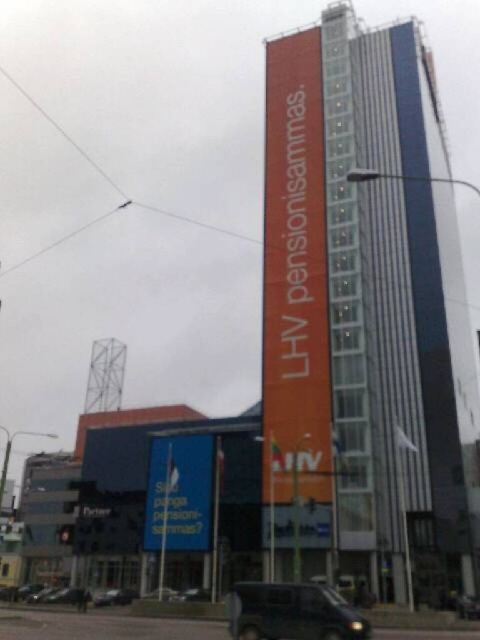
Question: Can you confirm if dark gray matte van at lower center is positioned below metallic silver car at lower center?

Choices:
 (A) yes
 (B) no

Answer: (B)

Question: Among these objects, which one is nearest to the camera?

Choices:
 (A) metallic lattice tower at center
 (B) orange glass tower at center

Answer: (B)

Question: Which point appears closest to the camera in this image?

Choices:
 (A) (108, 593)
 (B) (370, 129)
 (C) (113, 362)

Answer: (A)

Question: Considering the relative positions of dark gray matte van at lower center and metallic silver car at lower center in the image provided, where is dark gray matte van at lower center located with respect to metallic silver car at lower center?

Choices:
 (A) above
 (B) below

Answer: (A)

Question: Which point appears closest to the camera in this image?

Choices:
 (A) click(123, 600)
 (B) click(278, 611)
 (C) click(104, 378)

Answer: (B)

Question: Is dark gray matte van at lower center below metallic silver car at lower center?

Choices:
 (A) no
 (B) yes

Answer: (A)